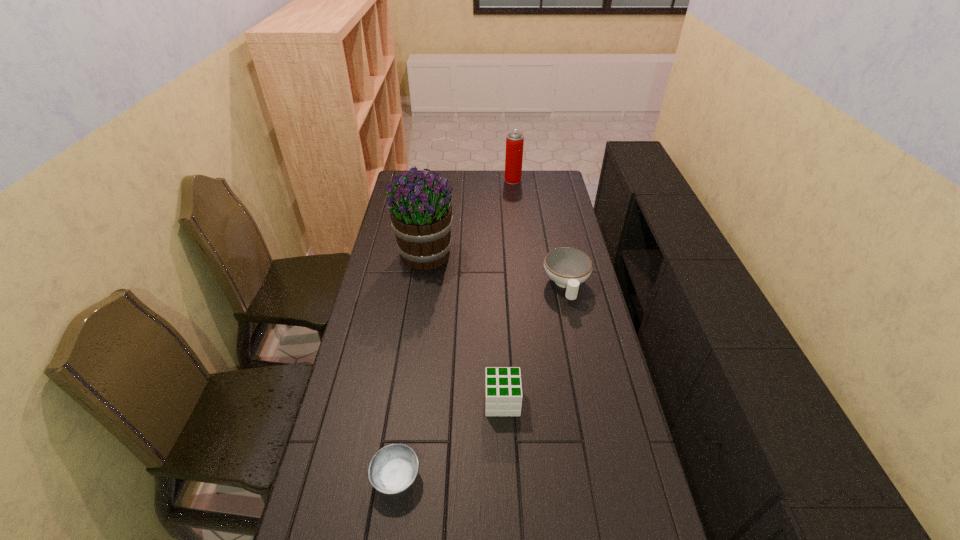
Find the location of a particular element. The width and height of the screenshot is (960, 540). bouquet is located at coordinates (421, 216).

Locate an element on the screen. The width and height of the screenshot is (960, 540). aerosol can is located at coordinates (514, 141).

I want to click on the farthest object, so click(x=514, y=141).

The width and height of the screenshot is (960, 540). What are the coordinates of `the second nearest object` in the screenshot? It's located at (503, 390).

At what (x,y) coordinates should I click in order to perform the action: click on the third object from right to left. Please return your answer as a coordinate pair (x, y). The width and height of the screenshot is (960, 540). Looking at the image, I should click on (503, 390).

Identify the location of chinaware. This screenshot has width=960, height=540. (568, 267).

Find the location of a particular element. the shortest object is located at coordinates (393, 468).

You are a GUI agent. You are given a task and a screenshot of the screen. Output one action in this format:
    pyautogui.click(x=<x>, y=<y>)
    Task: Click on the nearest object
    This screenshot has height=540, width=960.
    Given the screenshot: What is the action you would take?
    pyautogui.click(x=393, y=468)

The height and width of the screenshot is (540, 960). I want to click on free space located on the front of the tallest object, so click(414, 330).

You are a GUI agent. You are given a task and a screenshot of the screen. Output one action in this format:
    pyautogui.click(x=<x>, y=<y>)
    Task: Click on the free region located 0.250m on the left of the second tallest object
    The image size is (960, 540).
    Given the screenshot: What is the action you would take?
    (x=457, y=180)